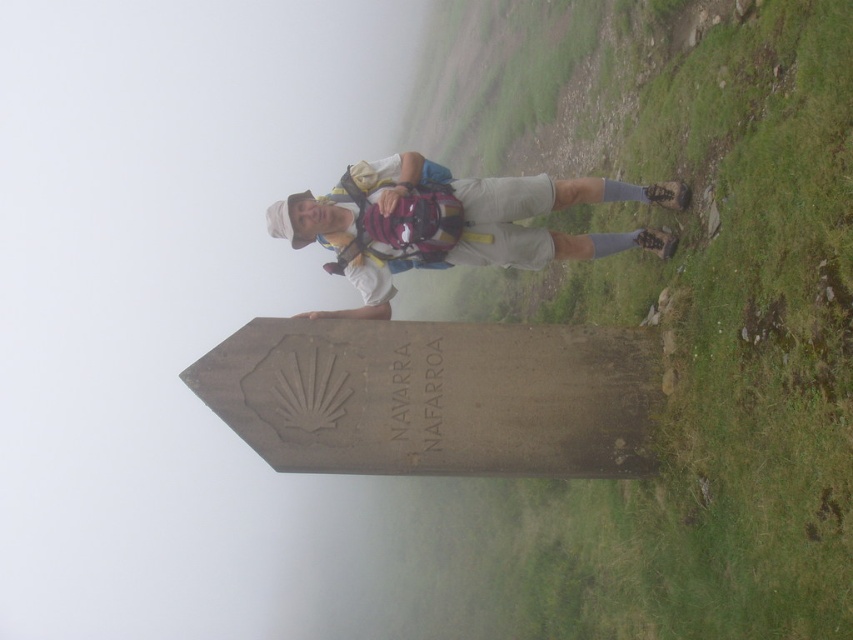
Question: Does smooth stone marker at center appear on the left side of gray stone signpost at center?

Choices:
 (A) yes
 (B) no

Answer: (B)

Question: Can you confirm if smooth stone marker at center is thinner than gray stone signpost at center?

Choices:
 (A) yes
 (B) no

Answer: (A)

Question: Among these points, which one is farthest from the camera?

Choices:
 (A) click(653, 492)
 (B) click(514, 262)

Answer: (B)

Question: Which point is farther from the camera taking this photo?

Choices:
 (A) (433, 148)
 (B) (670, 182)

Answer: (A)

Question: Among these objects, which one is nearest to the camera?

Choices:
 (A) smooth stone marker at center
 (B) gray stone signpost at center
 (C) matte white shirt at center

Answer: (A)

Question: Does smooth stone marker at center have a greater width compared to matte white shirt at center?

Choices:
 (A) no
 (B) yes

Answer: (B)